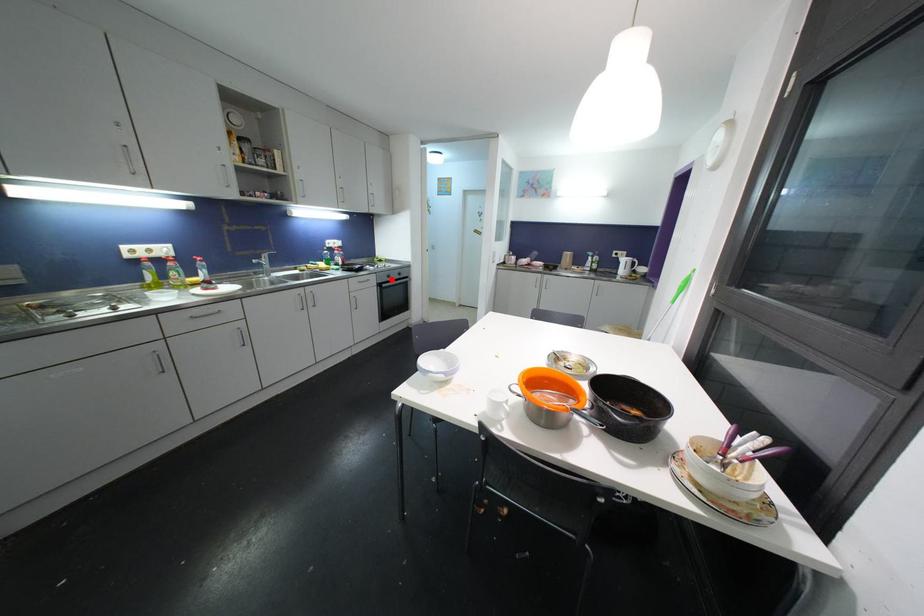
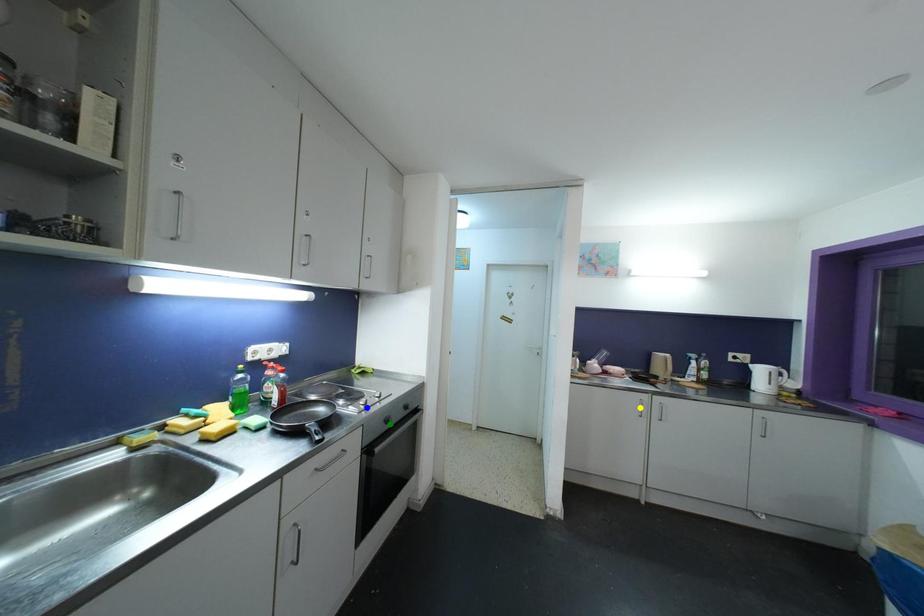
Question: I am providing you with two images of the same scene from different viewpoints. A red point is marked on the first image. You are given multiple points on the second image. In image 2, which mark is for the same physical point as the one in image 1?

Choices:
 (A) green point
 (B) yellow point
 (C) blue point

Answer: (A)